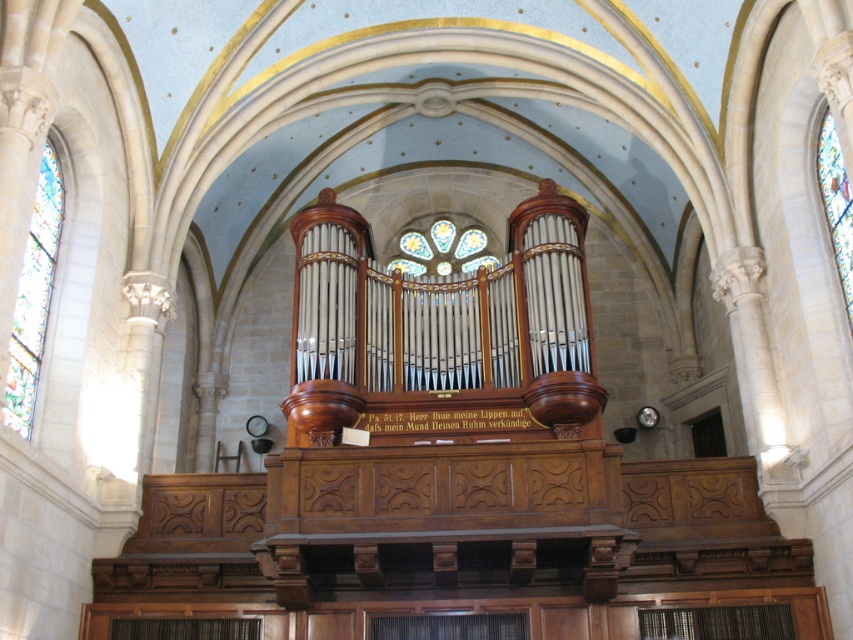
Is stained glass at left shorter than stained glass window at right?

In fact, stained glass at left may be taller than stained glass window at right.

Can you confirm if stained glass at left is positioned below stained glass window at right?

Yes, stained glass at left is below stained glass window at right.

Is point (39, 212) more distant than point (846, 275)?

Yes.

Locate an element on the screen. The height and width of the screenshot is (640, 853). stained glass at left is located at coordinates (33, 296).